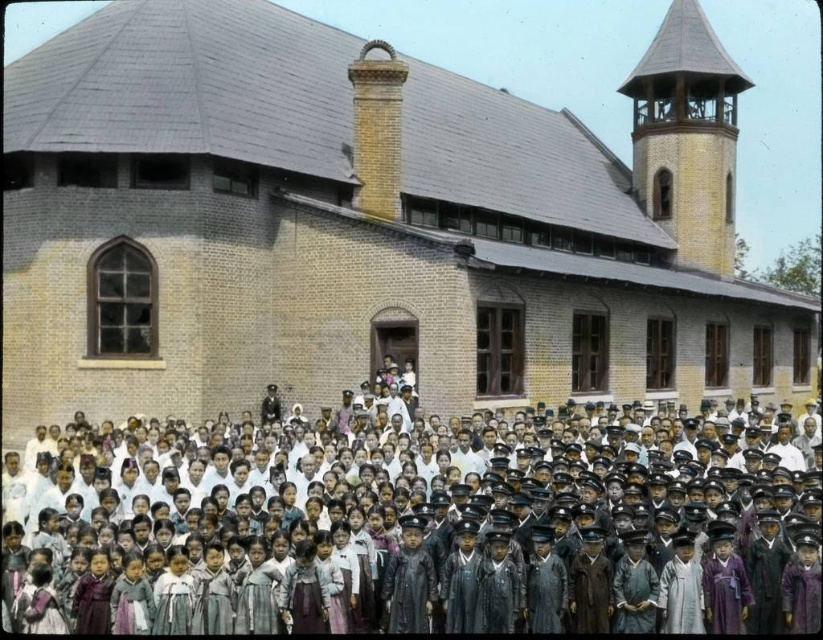
You are a photographer standing in front of the yellow brick church at center and the wooden spire at upper right. You want to capture a photo that includes both objects in the frame. Based on their positions, which object should you focus on first to ensure both are in the shot?

The yellow brick church at center is below the wooden spire at upper right, so you should focus on the wooden spire at upper right first to ensure both are in the frame.

You are standing at point (407, 532) in the image. What is the color and type of clothing you see at your current location?

The dark brown uniform at center is located at point (407, 532).

You are a photographer trying to capture both the yellow brick church at center and the dark brown uniform at center in a single frame. Given their sizes, which object should you focus on to ensure both are clearly visible in the photo?

Since the yellow brick church at center is larger than the dark brown uniform at center, you should focus on the yellow brick church at center to ensure both are clearly visible in the photo.